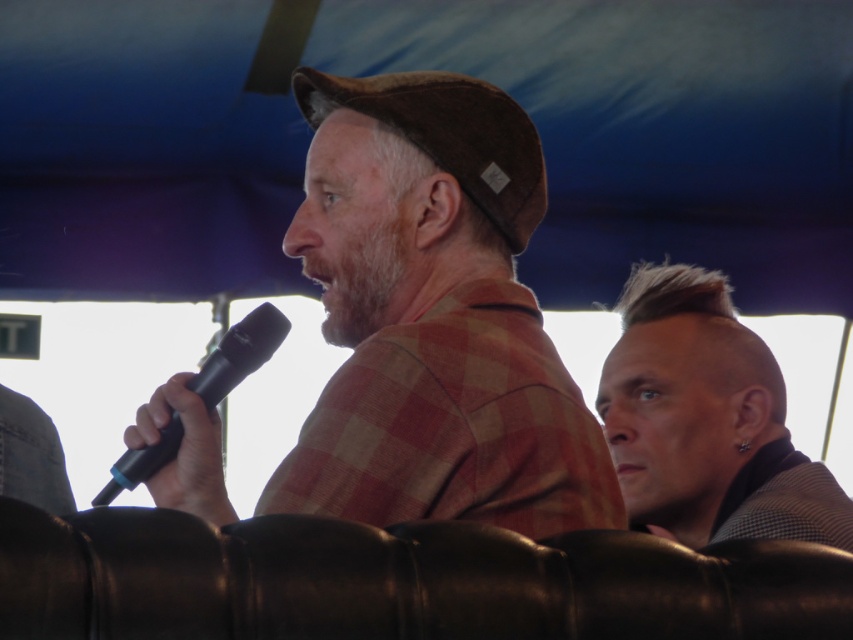
You are a photographer at the event and want to capture a photo of the two speakers. The sleek silver hair at right and the black matte microphone at center are in your frame. Based on their positions, which object is closer to the camera?

The sleek silver hair at right is positioned under the black matte microphone at center, meaning it is closer to the camera than the microphone.

In the scene shown: You are organizing a photo shoot and need to place a small prop between the brown woolen cap at center and the sleek silver hair at right. Based on their sizes, which object should the prop be placed closer to?

The prop should be placed closer to the sleek silver hair at right because the brown woolen cap at center is wider, so the space between them is closer to the smaller object.

You are standing in front of the scene under the blue canopy. There are two points marked in the image. Which point, point (674, 305) or point (178, 435), is closer to you?

Point (674, 305) is further to the viewer than point (178, 435), so the closer point to you is point (178, 435).